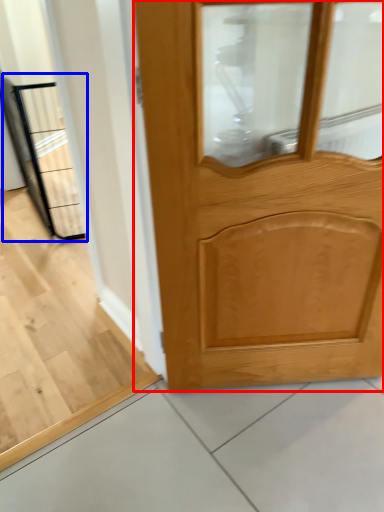
Question: Which of the following is the closest to the observer, door (highlighted by a red box) or elevator (highlighted by a blue box)?

Choices:
 (A) door
 (B) elevator

Answer: (A)